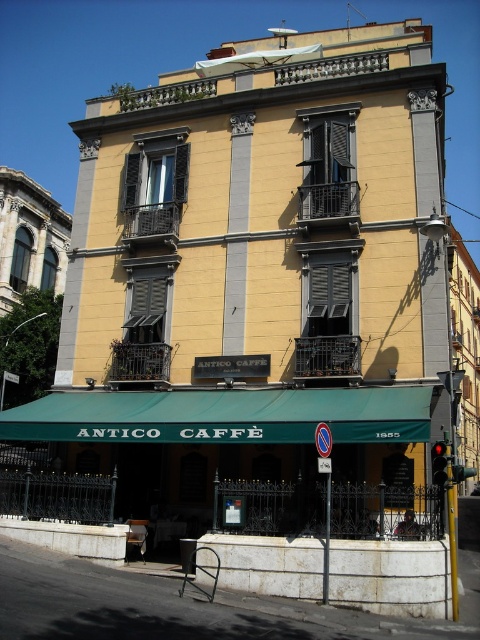
Question: Which point is farther from the camera taking this photo?

Choices:
 (A) coord(338,300)
 (B) coord(323,189)

Answer: (B)

Question: Which object appears closest to the camera in this image?

Choices:
 (A) black matte shutter at center
 (B) black matte shutters at center

Answer: (B)

Question: Considering the relative positions of black matte shutters at center and black matte shutter at center in the image provided, where is black matte shutters at center located with respect to black matte shutter at center?

Choices:
 (A) below
 (B) above

Answer: (A)

Question: Can you confirm if black matte shutters at center is positioned to the right of black matte shutter at center?

Choices:
 (A) no
 (B) yes

Answer: (A)

Question: Which point appears closest to the camera in this image?

Choices:
 (A) (315, 212)
 (B) (334, 348)

Answer: (B)

Question: Is black matte shutters at center bigger than black matte shutter at center?

Choices:
 (A) no
 (B) yes

Answer: (A)